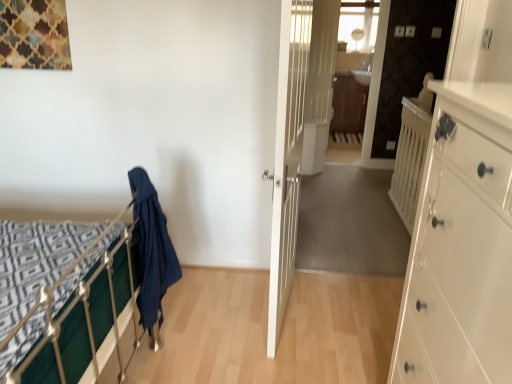
Identify the location of vacant space underneath dark blue fabric at left (from a real-world perspective). The height and width of the screenshot is (384, 512). pyautogui.click(x=159, y=337).